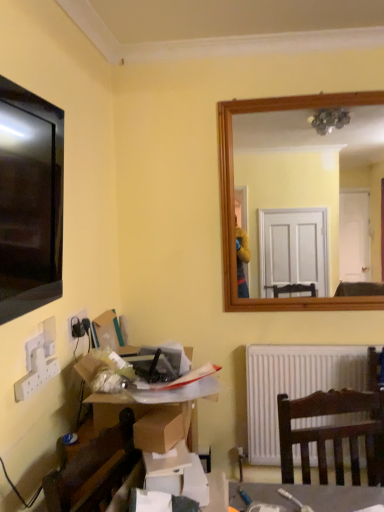
Question: From a real-world perspective, is cardboard box at lower left positioned above or below white matte radiator at lower center?

Choices:
 (A) above
 (B) below

Answer: (A)

Question: Considering the positions of cardboard box at lower left and white matte radiator at lower center in the image, is cardboard box at lower left wider or thinner than white matte radiator at lower center?

Choices:
 (A) thin
 (B) wide

Answer: (B)

Question: Which object is positioned farthest from the cardboard box at lower left?

Choices:
 (A) white matte radiator at lower center
 (B) black plastic socket at lower left

Answer: (A)

Question: Based on their relative distances, which object is nearer to the black plastic socket at lower left?

Choices:
 (A) white matte radiator at lower center
 (B) cardboard box at lower left

Answer: (B)